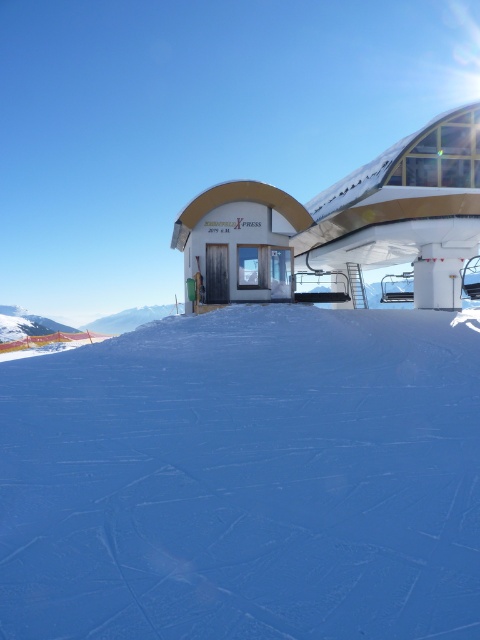
Based on the photo, you are a skier planning to take a photo of the white glossy building at center from the white smooth snow at center. Considering the size difference between them, which object would appear larger in your photo?

The white glossy building at center would appear larger in the photo because it is larger in size compared to the white smooth snow at center.

You are a skier who has just reached the top of the mountain. You want to slide down the slope towards the white glossy building at center. However, your skis are 2 meters long. Can your skis safely reach the white smooth snow at center before the building?

The distance between the white smooth snow at center and the white glossy building at center is 16.96 meters. Since your skis are 2 meters long, you have enough space to safely reach the white smooth snow at center before the building.

You are standing at the point marked by coordinates point at (245, 480). Which surface are you currently standing on?

The point at (245, 480) is on white smooth snow at center.